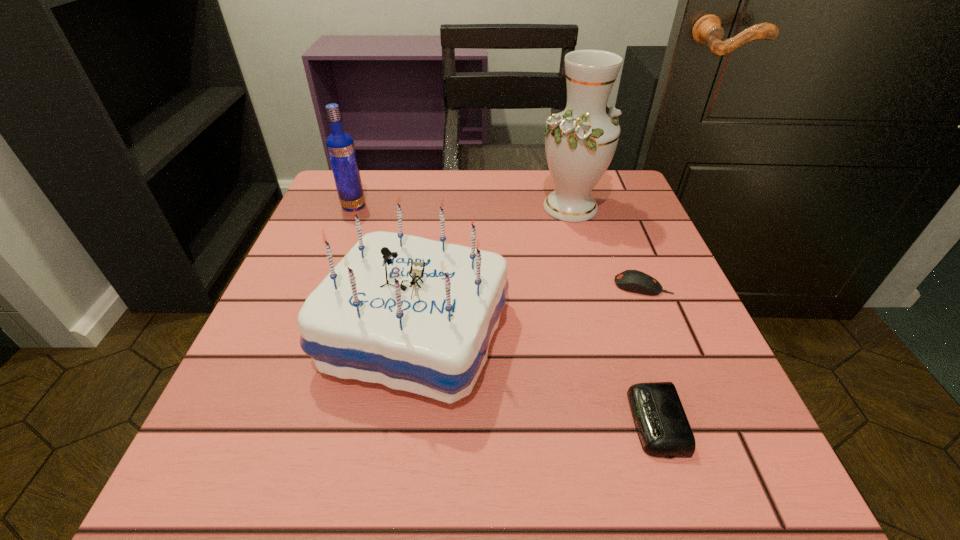
This screenshot has height=540, width=960. Find the location of `the tallest object`. the tallest object is located at coordinates (x=580, y=142).

This screenshot has height=540, width=960. Find the location of `the leftmost object`. the leftmost object is located at coordinates (340, 146).

Locate an element on the screen. The width and height of the screenshot is (960, 540). birthday cake is located at coordinates (414, 314).

This screenshot has width=960, height=540. In order to click on computer mouse in this screenshot , I will do `click(635, 281)`.

In order to click on alarm clock in this screenshot , I will do `click(663, 428)`.

Image resolution: width=960 pixels, height=540 pixels. What are the coordinates of `vacant space located on the right of the tallest object` in the screenshot? It's located at (632, 207).

Find the location of a particular element. vacant space located on the front of the vodka is located at coordinates point(311,318).

Image resolution: width=960 pixels, height=540 pixels. I want to click on free spot located 0.080m on the front of the second object from left to right, so click(x=396, y=473).

Find the location of `free location located 0.380m on the left of the computer mouse`. free location located 0.380m on the left of the computer mouse is located at coordinates (409, 286).

Where is `vacant space located 0.110m on the display of the alarm clock`? The width and height of the screenshot is (960, 540). vacant space located 0.110m on the display of the alarm clock is located at coordinates (554, 421).